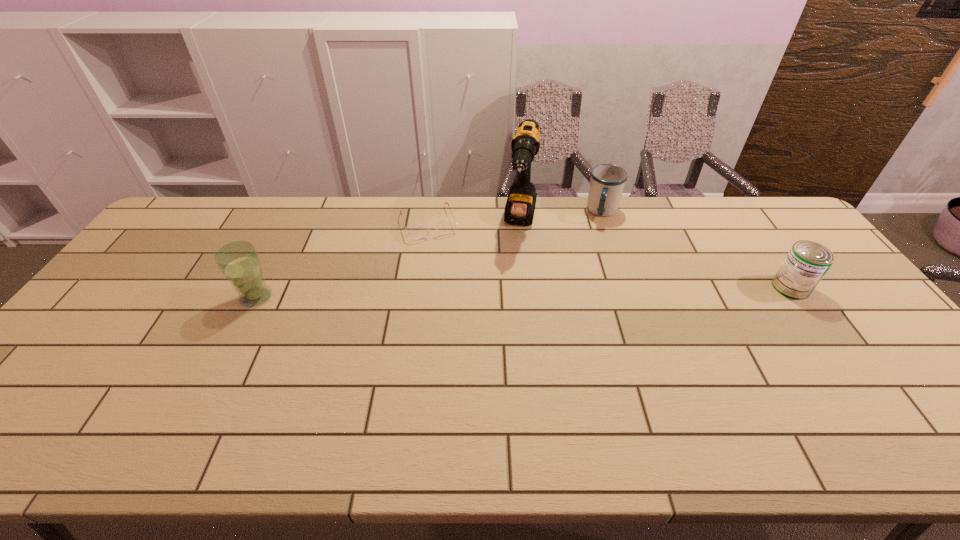
At what (x,y) coordinates should I click in order to perform the action: click on drill at the far edge. Please return your answer as a coordinate pair (x, y). Image resolution: width=960 pixels, height=540 pixels. Looking at the image, I should click on (519, 210).

Find the location of a particular element. This screenshot has height=540, width=960. object that is at the right edge is located at coordinates (807, 262).

The image size is (960, 540). Identify the location of vacant space at the far edge of the desktop. point(371,208).

Locate an element on the screen. The height and width of the screenshot is (540, 960). free region at the near edge of the desktop is located at coordinates (505, 393).

Where is `free space at the left edge`? The height and width of the screenshot is (540, 960). free space at the left edge is located at coordinates (144, 301).

The width and height of the screenshot is (960, 540). In the image, there is a desktop. In order to click on vacant space at the right edge in this screenshot , I will do `click(853, 310)`.

Find the location of a particular element. vacant space at the far left corner of the desktop is located at coordinates (227, 197).

Where is `vacant space at the far right corner`? This screenshot has height=540, width=960. vacant space at the far right corner is located at coordinates (757, 229).

Identify the location of unoccupied position between the third object from left to right and the can. (656, 254).

This screenshot has width=960, height=540. I want to click on empty space between the spectacles and the leftmost object, so click(343, 260).